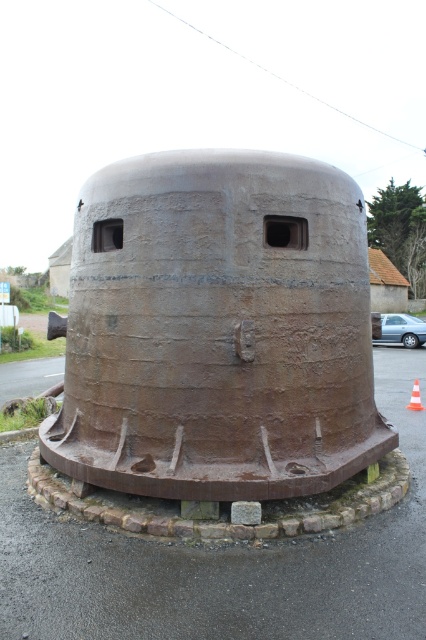
You are a photographer planning to capture both the rusty metal water tower at center and the silver metallic car at center in a single frame. Given their sizes, which object should you position closer to the camera to ensure both are visible clearly?

The rusty metal water tower at center is smaller than the silver metallic car at center, so to ensure both are visible clearly in a single frame, you should position the silver metallic car at center closer to the camera.